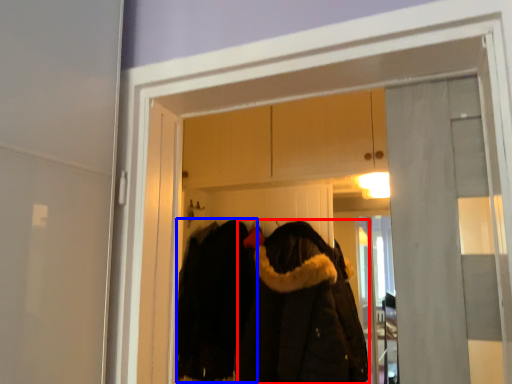
Question: Among these objects, which one is farthest to the camera, cloak (highlighted by a red box) or cloak (highlighted by a blue box)?

Choices:
 (A) cloak
 (B) cloak

Answer: (B)